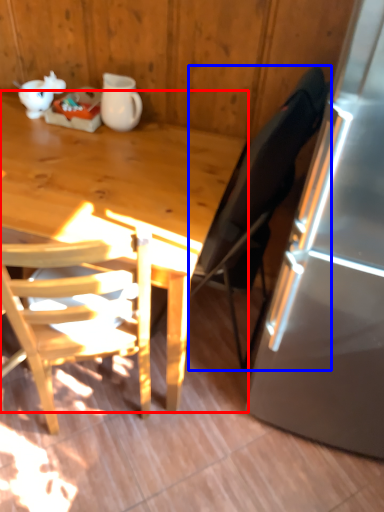
Question: Among these objects, which one is farthest to the camera, desk (highlighted by a red box) or chair (highlighted by a blue box)?

Choices:
 (A) desk
 (B) chair

Answer: (A)